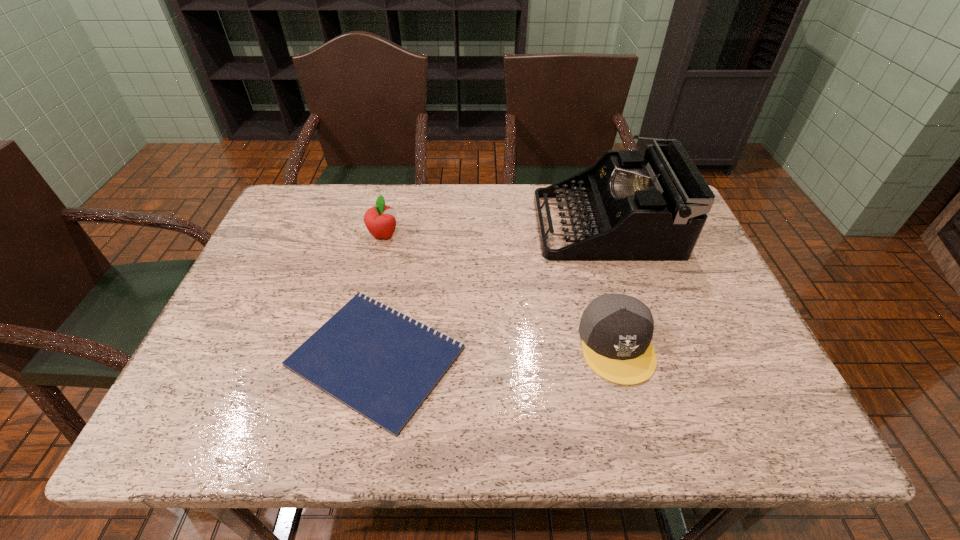
Find the location of a particular element. The image size is (960, 540). typewriter is located at coordinates (653, 208).

Locate an element on the screen. The image size is (960, 540). apple is located at coordinates (380, 220).

Where is `the third tallest object`? The height and width of the screenshot is (540, 960). the third tallest object is located at coordinates (616, 330).

This screenshot has width=960, height=540. In order to click on notepad in this screenshot , I will do `click(381, 363)`.

Where is `vacant space positioned 0.360m on the typing side of the tallest object`? The image size is (960, 540). vacant space positioned 0.360m on the typing side of the tallest object is located at coordinates (413, 225).

This screenshot has height=540, width=960. What are the coordinates of `free space located on the typing side of the tallest object` in the screenshot? It's located at (447, 225).

This screenshot has height=540, width=960. I want to click on free space located 0.120m on the typing side of the tallest object, so coord(495,225).

In order to click on blank space located 0.050m on the left of the apple in this screenshot , I will do `click(350, 235)`.

In order to click on free point located on the front-facing side of the third tallest object in this screenshot , I will do `click(640, 433)`.

You are a GUI agent. You are given a task and a screenshot of the screen. Output one action in this format:
    pyautogui.click(x=<x>, y=<y>)
    Task: Click on the free spot located on the right of the shortest object
    
    Given the screenshot: What is the action you would take?
    point(646,357)